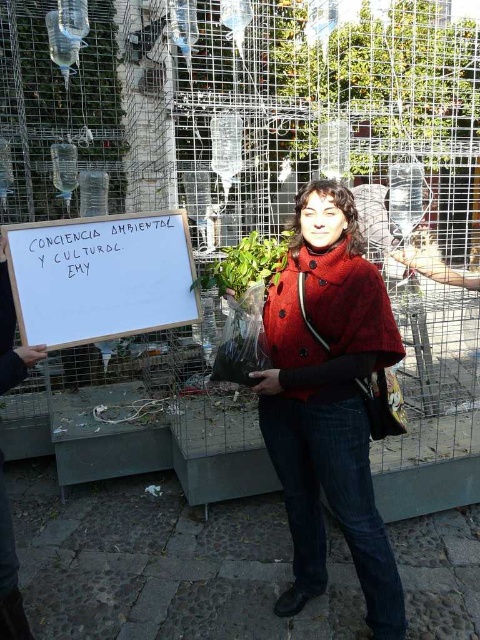
Question: Does knitted woolen cape at center appear on the left side of white wood sign at center?

Choices:
 (A) yes
 (B) no

Answer: (B)

Question: Is knitted woolen cape at center thinner than white wood sign at center?

Choices:
 (A) yes
 (B) no

Answer: (B)

Question: Which point appears farthest from the camera in this image?

Choices:
 (A) (362, 275)
 (B) (105, 305)

Answer: (B)

Question: Which of the following is the closest to the observer?

Choices:
 (A) knitted woolen cape at center
 (B) white wood sign at center

Answer: (B)

Question: Does knitted woolen cape at center appear on the left side of white wood sign at center?

Choices:
 (A) no
 (B) yes

Answer: (A)